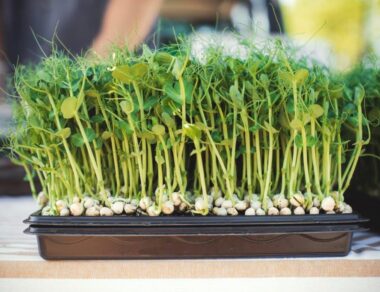
At what (x,y) coordinates should I click in order to perform the action: click on edge of wood plank. Please return your answer as a coordinate pair (x, y). The width and height of the screenshot is (380, 292). Looking at the image, I should click on (181, 271).